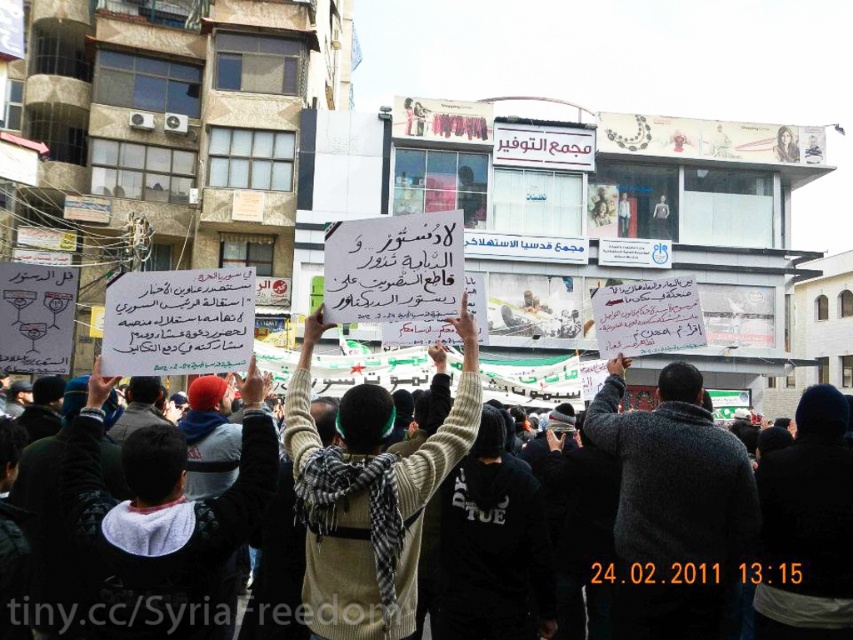
Question: Among these objects, which one is nearest to the camera?

Choices:
 (A) gray wool sweater at center
 (B) white paper sign at center
 (C) white knitted sweater at center

Answer: (B)

Question: Which of these objects is positioned farthest from the white paper sign at center?

Choices:
 (A) gray wool sweater at center
 (B) white knitted sweater at center

Answer: (A)

Question: Is white paper sign at center bigger than white knitted sweater at center?

Choices:
 (A) yes
 (B) no

Answer: (A)

Question: Is gray wool sweater at center wider than white knitted sweater at center?

Choices:
 (A) yes
 (B) no

Answer: (B)

Question: Is gray wool sweater at center smaller than white knitted sweater at center?

Choices:
 (A) no
 (B) yes

Answer: (B)

Question: Among these objects, which one is farthest from the camera?

Choices:
 (A) gray wool sweater at center
 (B) white paper sign at center

Answer: (A)